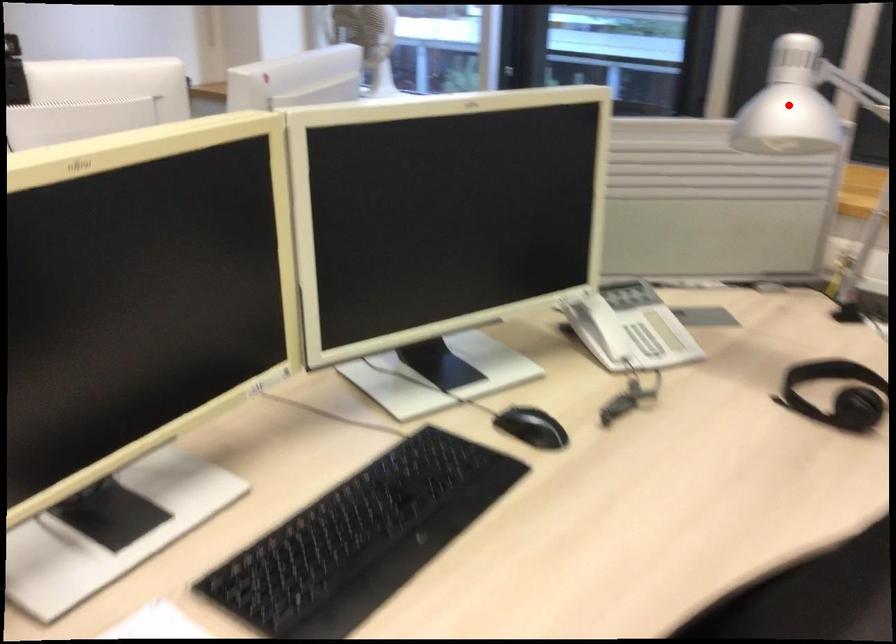
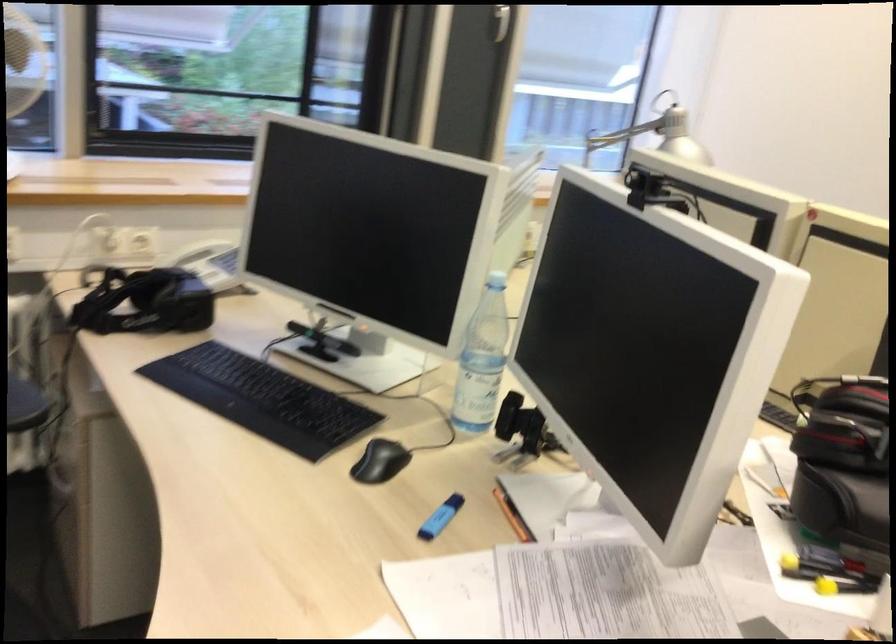
The point at the highlighted location is marked in the first image. Where is the corresponding point in the second image?

(693, 136)